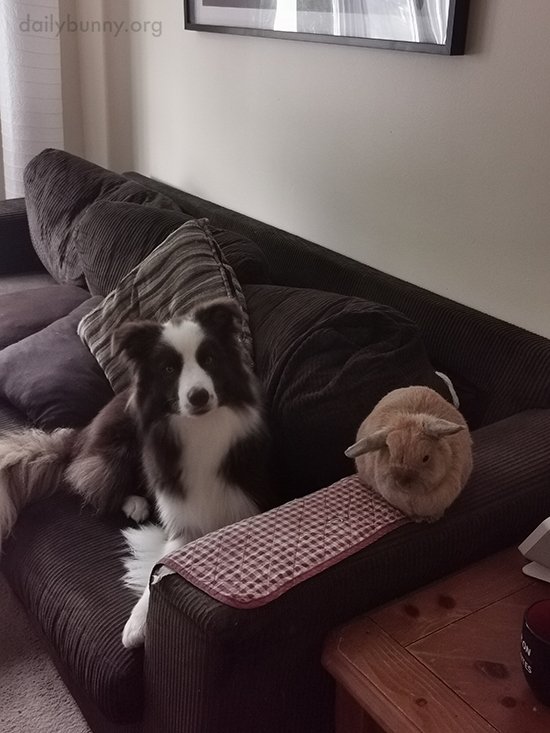
Find the location of a particular element. This screenshot has width=550, height=733. framed art is located at coordinates (362, 12).